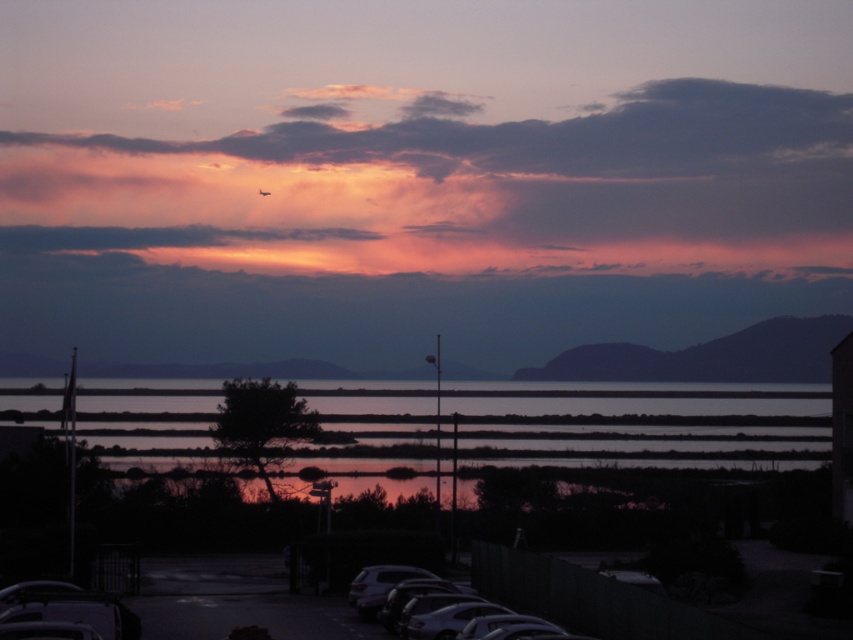
Between point (572, 429) and point (355, 582), which one is positioned behind?

The point (572, 429) is more distant.

Is silvery reflective water at center thinner than matte white car at lower center?

In fact, silvery reflective water at center might be wider than matte white car at lower center.

Measure the distance between silvery reflective water at center and camera.

They are 81.11 meters apart.

Locate an element on the screen. Image resolution: width=853 pixels, height=640 pixels. silvery reflective water at center is located at coordinates (635, 426).

Is matte pink cloud at upper center wider than silvery reflective water at center?

Yes, matte pink cloud at upper center is wider than silvery reflective water at center.

This screenshot has height=640, width=853. What do you see at coordinates (460, 188) in the screenshot?
I see `matte pink cloud at upper center` at bounding box center [460, 188].

Identify the location of matte pink cloud at upper center. The height and width of the screenshot is (640, 853). (460, 188).

Looking at this image, who is lower down, metallic silver car at lower center or matte white car at lower center?

matte white car at lower center is lower down.

What are the coordinates of `metallic silver car at lower center` in the screenshot? It's located at (405, 595).

At what (x,y) coordinates should I click in order to perform the action: click on metallic silver car at lower center. Please return your answer as a coordinate pair (x, y). The width and height of the screenshot is (853, 640). Looking at the image, I should click on (405, 595).

The width and height of the screenshot is (853, 640). Identify the location of metallic silver car at lower center. (405, 595).